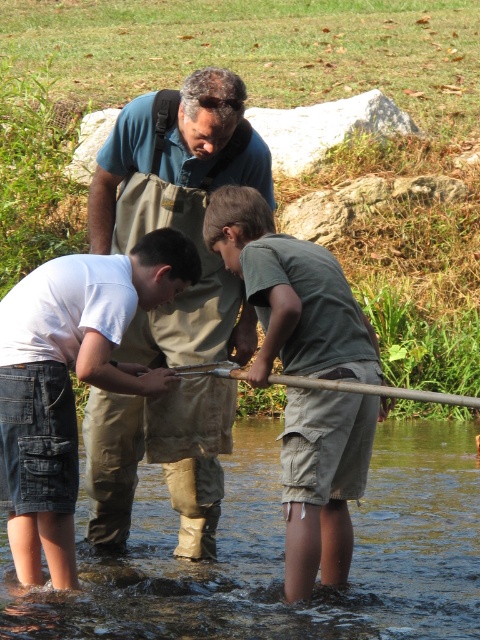
Question: Considering the relative positions of clear water at lower center and white cotton shirt at lower left in the image provided, where is clear water at lower center located with respect to white cotton shirt at lower left?

Choices:
 (A) right
 (B) left

Answer: (A)

Question: Is white cotton shirt at lower left bigger than green cotton shirt at center?

Choices:
 (A) no
 (B) yes

Answer: (A)

Question: Can you confirm if white cotton shirt at lower left is positioned to the left of green cotton shirt at center?

Choices:
 (A) no
 (B) yes

Answer: (B)

Question: Based on their relative distances, which object is farther from the white cotton shirt at lower left?

Choices:
 (A) green canvas apron at center
 (B) green cotton shirt at center

Answer: (B)

Question: Which object appears closest to the camera in this image?

Choices:
 (A) white cotton shirt at lower left
 (B) clear water at lower center
 (C) green cotton shirt at center
 (D) green canvas apron at center

Answer: (A)

Question: Among these points, which one is nearest to the camera?

Choices:
 (A) (286, 326)
 (B) (188, 218)

Answer: (A)